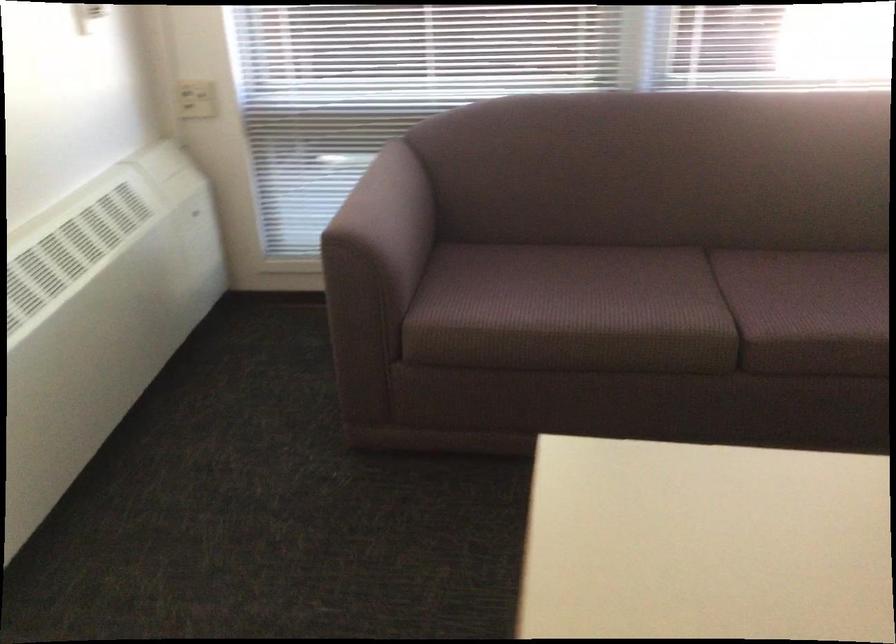
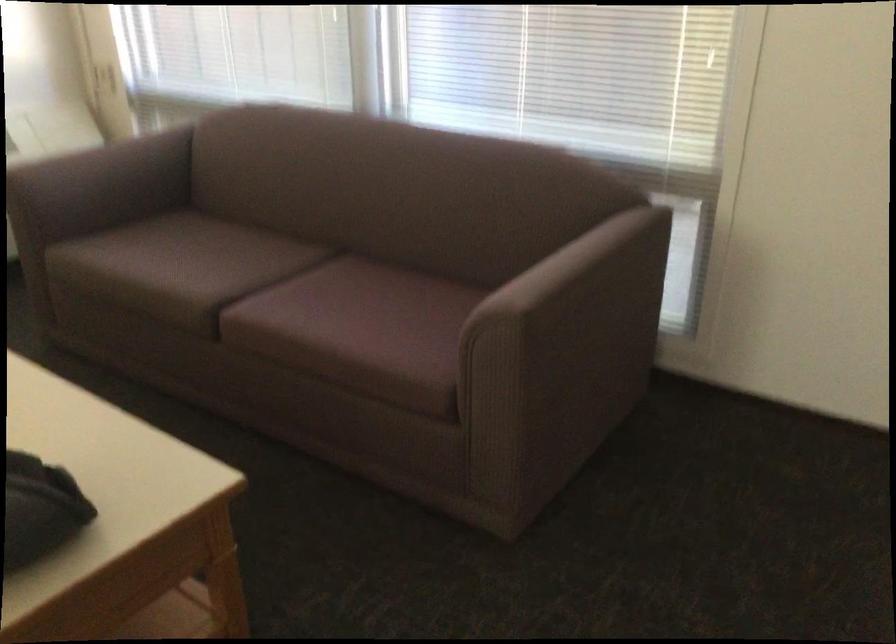
Question: In a continuous first-person perspective shot, in which direction is the camera moving?

Choices:
 (A) Left
 (B) Right
 (C) Forward
 (D) Backward

Answer: (B)